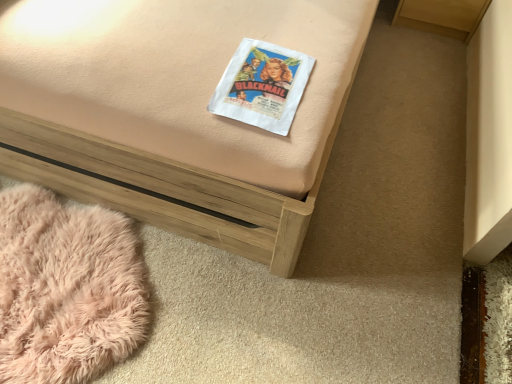
Find the location of a particular element. empty space that is ontop of fluffy pink rug at lower left (from a real-world perspective) is located at coordinates (58, 280).